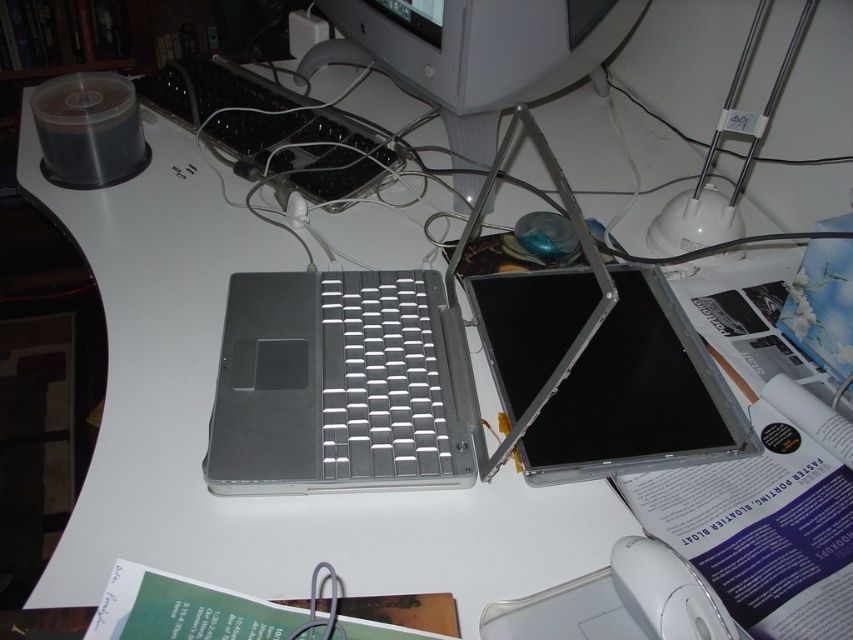
Question: Is silver metallic laptop at center to the right of silver metallic keyboard at center from the viewer's perspective?

Choices:
 (A) no
 (B) yes

Answer: (B)

Question: Which of the following is the farthest from the observer?

Choices:
 (A) (577, 26)
 (B) (260, 90)
 (C) (364, 396)
 (D) (671, 589)

Answer: (B)

Question: Which object appears closest to the camera in this image?

Choices:
 (A) silver metallic laptop at center
 (B) matte gray monitor at upper center
 (C) silver metallic keyboard at center
 (D) white plastic mouse at lower right

Answer: (D)

Question: Which point appears closest to the camera in this image?

Choices:
 (A) (624, 592)
 (B) (218, 435)
 (C) (502, 99)

Answer: (A)

Question: From the image, what is the correct spatial relationship of matte gray monitor at upper center in relation to white plastic mouse at lower right?

Choices:
 (A) left
 (B) right

Answer: (A)

Question: Is silver metallic laptop at center behind matte gray monitor at upper center?

Choices:
 (A) no
 (B) yes

Answer: (A)